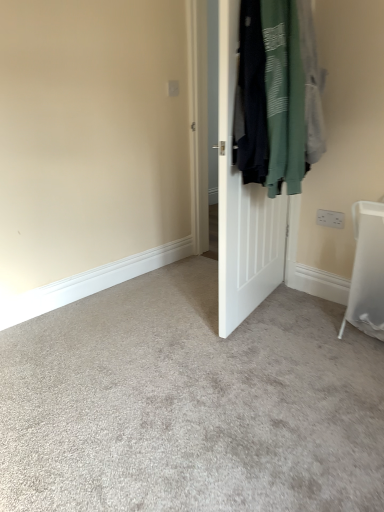
Question: Is white plastic electric outlet at upper right not near white matte door at center?

Choices:
 (A) yes
 (B) no

Answer: (B)

Question: Is white plastic electric outlet at upper right smaller than white matte door at center?

Choices:
 (A) yes
 (B) no

Answer: (A)

Question: From the image's perspective, is white plastic electric outlet at upper right located beneath white matte door at center?

Choices:
 (A) yes
 (B) no

Answer: (A)

Question: Is white plastic electric outlet at upper right positioned beyond the bounds of white matte door at center?

Choices:
 (A) yes
 (B) no

Answer: (A)

Question: Can you confirm if white plastic electric outlet at upper right is bigger than white matte door at center?

Choices:
 (A) yes
 (B) no

Answer: (B)

Question: Is white plastic electric outlet at upper right wider than white matte door at center?

Choices:
 (A) yes
 (B) no

Answer: (B)

Question: Does white matte door at center appear on the right side of dark green cotton sweatshirt at right?

Choices:
 (A) yes
 (B) no

Answer: (B)

Question: Can you confirm if white matte door at center is smaller than dark green cotton sweatshirt at right?

Choices:
 (A) no
 (B) yes

Answer: (B)

Question: Is white matte door at center turned away from dark green cotton sweatshirt at right?

Choices:
 (A) no
 (B) yes

Answer: (B)

Question: Can you confirm if white matte door at center is bigger than dark green cotton sweatshirt at right?

Choices:
 (A) yes
 (B) no

Answer: (B)

Question: From a real-world perspective, is white matte door at center on top of dark green cotton sweatshirt at right?

Choices:
 (A) no
 (B) yes

Answer: (A)

Question: Considering the relative sizes of white matte door at center and dark green cotton sweatshirt at right in the image provided, is white matte door at center taller than dark green cotton sweatshirt at right?

Choices:
 (A) yes
 (B) no

Answer: (A)

Question: Considering the relative sizes of white plastic electric outlet at upper right and dark green cotton sweatshirt at right in the image provided, is white plastic electric outlet at upper right thinner than dark green cotton sweatshirt at right?

Choices:
 (A) yes
 (B) no

Answer: (A)